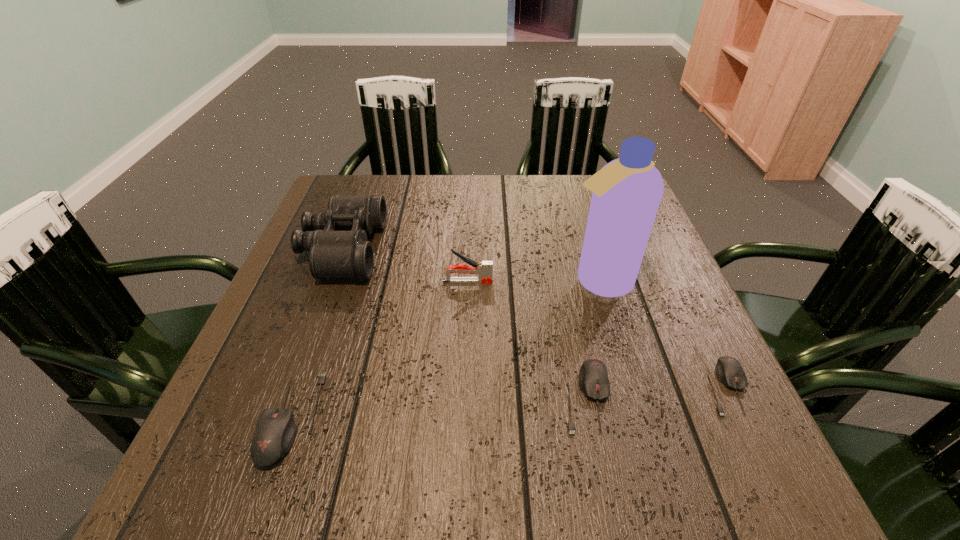
Where is `free space between the tallest object and the binoculars`? free space between the tallest object and the binoculars is located at coordinates (470, 265).

This screenshot has width=960, height=540. In order to click on vacant region between the second mouse from left to right and the stapler in this screenshot , I will do `click(527, 339)`.

The height and width of the screenshot is (540, 960). Identify the location of free spot between the leftmost mouse and the second mouse from left to right. (439, 407).

Where is `free space between the binoculars and the leftmost mouse`? free space between the binoculars and the leftmost mouse is located at coordinates (317, 333).

Where is `vacant point located between the fourth shortest object and the shortest mouse`? This screenshot has height=540, width=960. vacant point located between the fourth shortest object and the shortest mouse is located at coordinates (597, 334).

Image resolution: width=960 pixels, height=540 pixels. Find the location of `vacant space that's between the binoculars and the stapler`. vacant space that's between the binoculars and the stapler is located at coordinates (405, 265).

Find the location of a particular element. vacant area that lies between the binoculars and the shortest object is located at coordinates (535, 318).

Point out which object is positioned as the third nearest to the shortest mouse. Please provide its 2D coordinates. Your answer should be formatted as a tuple, i.e. [(x, y)], where the tuple contains the x and y coordinates of a point satisfying the conditions above.

[(484, 269)]

Choose which object is the nearest neighbor to the tallest object. Please provide its 2D coordinates. Your answer should be formatted as a tuple, i.e. [(x, y)], where the tuple contains the x and y coordinates of a point satisfying the conditions above.

[(484, 269)]

Point out which mouse is positioned as the second nearest to the second mouse from left to right. Please provide its 2D coordinates. Your answer should be formatted as a tuple, i.e. [(x, y)], where the tuple contains the x and y coordinates of a point satisfying the conditions above.

[(275, 432)]